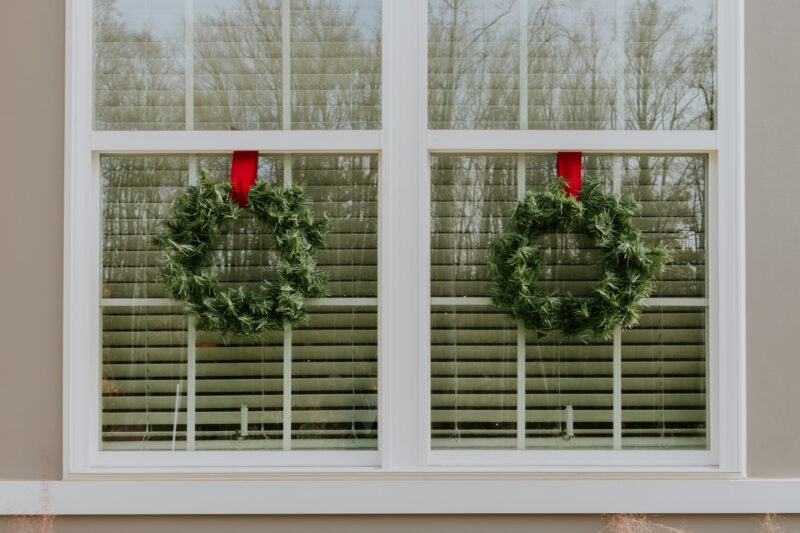
The image size is (800, 533). What are the coordinates of `bottom of right wreath` in the screenshot? It's located at (570, 330).